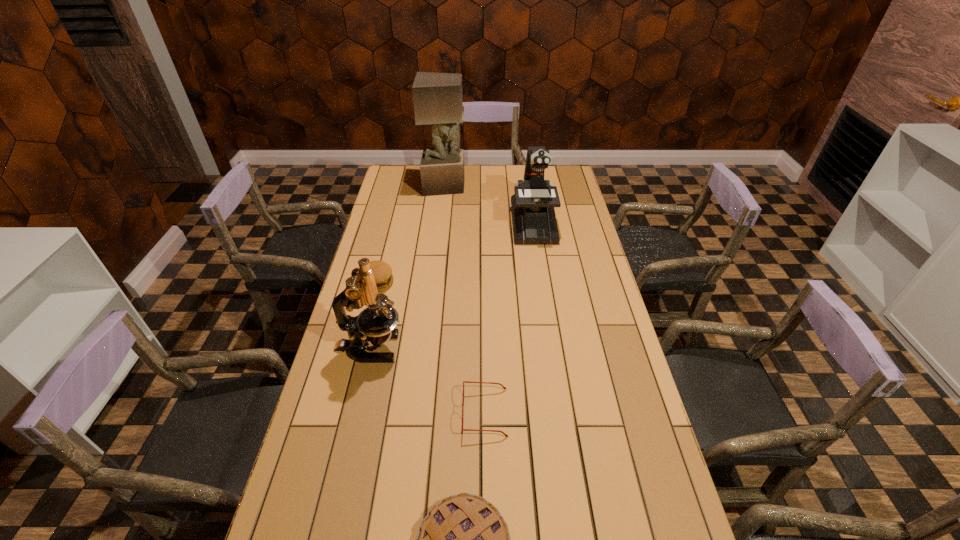
Identify the location of free point between the farthest object and the fifth tallest object. (466, 299).

Identify which object is the third nearest to the third shortest object. Please provide its 2D coordinates. Your answer should be formatted as a tuple, i.e. [(x, y)], where the tuple contains the x and y coordinates of a point satisfying the conditions above.

[(506, 435)]

Locate an element on the screen. Image resolution: width=960 pixels, height=540 pixels. object that is the third closest to the nearer microscope is located at coordinates (464, 539).

What are the coordinates of `free spot that satisfies the following two spatial constraints: 1. through the eyepieces of the rightmost object; 2. at the eyepiece of the nearer microscope` in the screenshot? It's located at (552, 348).

This screenshot has height=540, width=960. In order to click on vacant space that satisfies the following two spatial constraints: 1. through the eyepieces of the right microscope; 2. at the eyepiece of the fourth farthest object in this screenshot , I will do `click(552, 348)`.